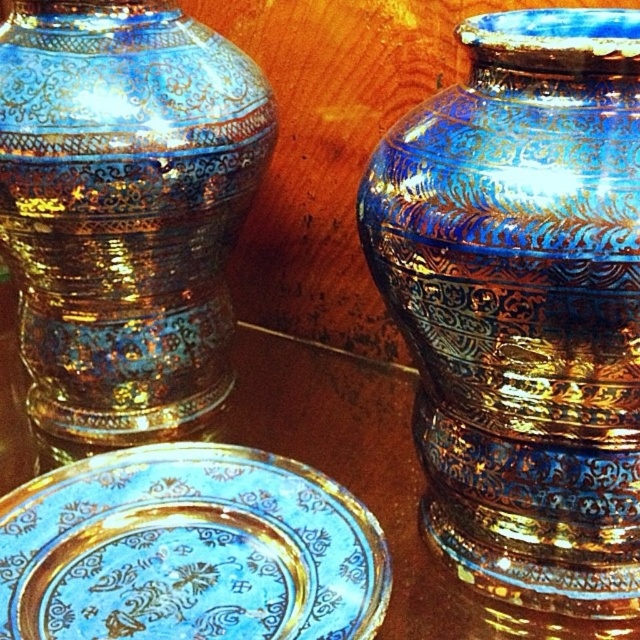
Question: Does blue-golden metallic vase at right appear under blue-golden metallic vase at left?

Choices:
 (A) no
 (B) yes

Answer: (B)

Question: Among these points, which one is farthest from the camera?

Choices:
 (A) (250, 170)
 (B) (272, 531)
 (C) (547, 401)

Answer: (A)

Question: Does blue-golden metallic vase at right have a lesser width compared to blue-golden metallic vase at left?

Choices:
 (A) no
 (B) yes

Answer: (B)

Question: Can you confirm if blue-golden metallic vase at left is thinner than blue glossy platter at center?

Choices:
 (A) yes
 (B) no

Answer: (A)

Question: Which point is farther to the camera?

Choices:
 (A) blue-golden metallic vase at right
 (B) blue glossy plate at center
 (C) blue glossy platter at center

Answer: (B)

Question: Which object is positioned farthest from the blue glossy plate at center?

Choices:
 (A) blue glossy platter at center
 (B) blue-golden metallic vase at left
 (C) blue-golden metallic vase at right

Answer: (C)